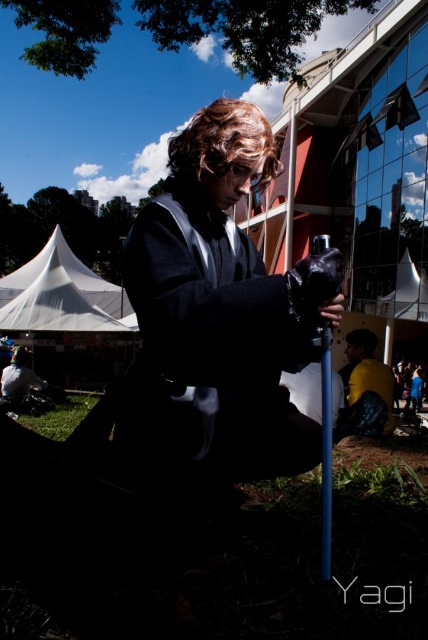
Question: Can you confirm if matte black kimono at center is positioned below yellow matte jacket at lower right?

Choices:
 (A) yes
 (B) no

Answer: (B)

Question: Which of the following is the closest to the observer?

Choices:
 (A) matte black kimono at center
 (B) yellow matte jacket at lower right

Answer: (A)

Question: Is matte black kimono at center to the right of yellow matte jacket at lower right from the viewer's perspective?

Choices:
 (A) yes
 (B) no

Answer: (B)

Question: Is matte black kimono at center wider than yellow matte jacket at lower right?

Choices:
 (A) yes
 (B) no

Answer: (A)

Question: Which point is closer to the camera?

Choices:
 (A) (265, 278)
 (B) (356, 358)

Answer: (A)

Question: Which point is farther from the camera taking this photo?

Choices:
 (A) (190, 157)
 (B) (353, 400)

Answer: (B)